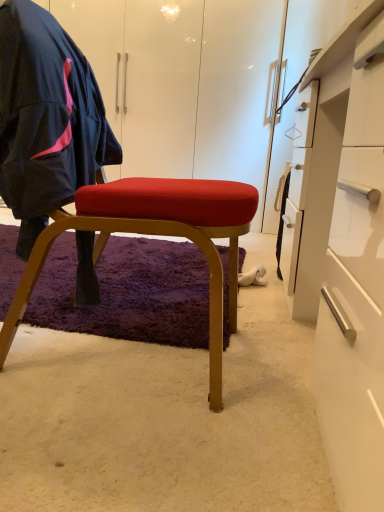
Question: Is point (254, 276) closer or farther from the camera than point (331, 228)?

Choices:
 (A) farther
 (B) closer

Answer: (A)

Question: In the image, is white suede shoe at lower center positioned in front of or behind white glossy desk at center right?

Choices:
 (A) front
 (B) behind

Answer: (B)

Question: Which object is positioned closest to the matte black jacket at left?

Choices:
 (A) white glossy desk at center right
 (B) matte gold stool at center
 (C) white suede shoe at lower center

Answer: (B)

Question: Which of these objects is positioned farthest from the white glossy desk at center right?

Choices:
 (A) white suede shoe at lower center
 (B) matte gold stool at center
 (C) matte black jacket at left

Answer: (A)